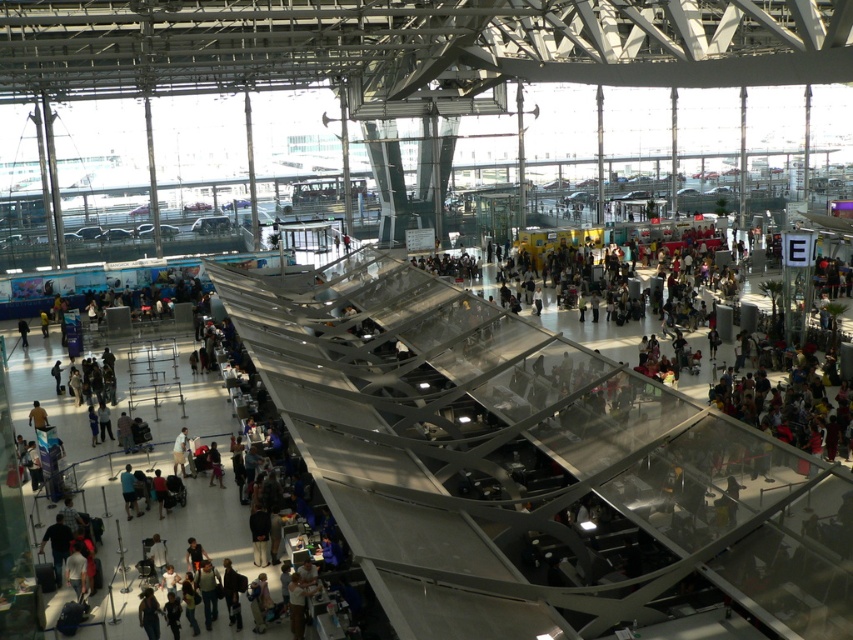
Question: Which point is farther to the camera?

Choices:
 (A) (132, 486)
 (B) (152, 483)
 (C) (177, 448)
 (D) (218, 468)

Answer: (C)

Question: Does dark blue jeans at center appear on the left side of light brown fabric pants at center?

Choices:
 (A) no
 (B) yes

Answer: (B)

Question: Which of the following is the closest to the observer?

Choices:
 (A) (178, 464)
 (B) (123, 472)
 (C) (210, 465)

Answer: (B)

Question: Does dark blue jeans at center appear over light brown fabric pants at center?

Choices:
 (A) no
 (B) yes

Answer: (A)

Question: Estimate the real-world distances between objects in this image. Which object is farther from the dark blue jeans at center?

Choices:
 (A) dark blue shirt at center
 (B) light brown leather jacket at center
 (C) light brown fabric pants at center

Answer: (B)

Question: Is light brown fabric pants at center behind dark blue shirt at center?

Choices:
 (A) no
 (B) yes

Answer: (B)